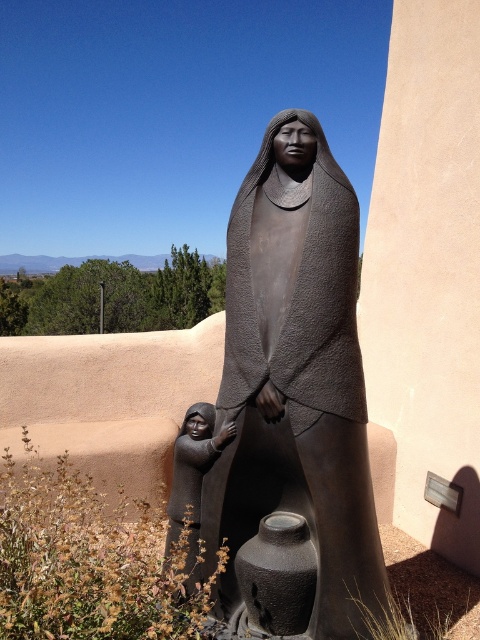
You are a tour guide leading a group near the matte bronze statue at center and the matte black figure at lower left. You want to place a 12 inch wide information plaque between them. Will there be enough space?

The distance between the matte bronze statue at center and the matte black figure at lower left is 13.93 inches, which is more than enough to accommodate a 12 inch wide information plaque between them.

You are an art curator planning to display the matte bronze statue at center and the matte black figure at lower left in a gallery. Given their sizes, which one would require a taller base to ensure stability?

The matte bronze statue at center requires a taller base because it has a greater height compared to the matte black figure at lower left, ensuring stability proportional to its size.

You are an art conservator assessing the placement of the statue. The statue is located at point (292, 406). Given that the statue is made of matte bronze, what material is the statue constructed from?

The statue is constructed from matte bronze as indicated by the point (292, 406).